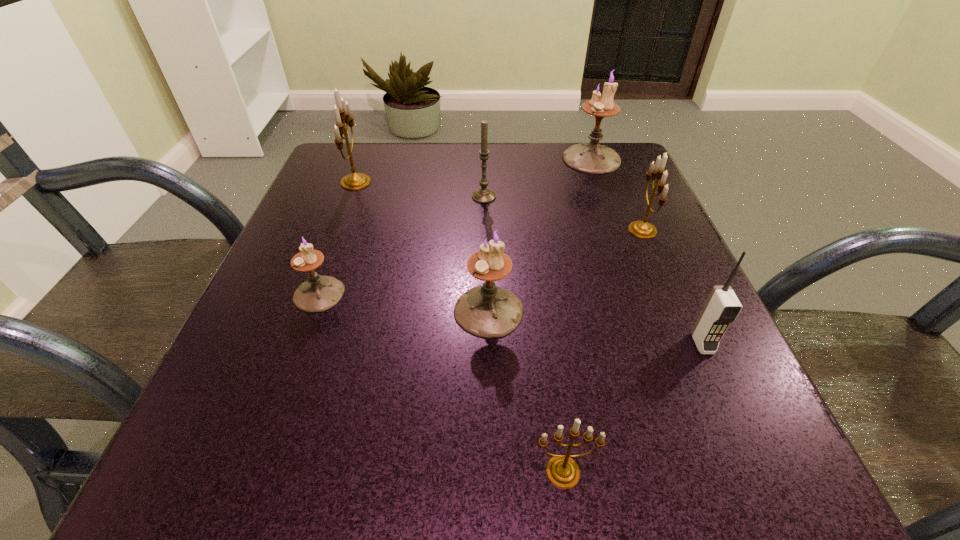
Image resolution: width=960 pixels, height=540 pixels. I want to click on free region at the near right corner of the desktop, so click(x=752, y=451).

You are a GUI agent. You are given a task and a screenshot of the screen. Output one action in this format:
    pyautogui.click(x=<x>, y=<y>)
    Task: Click on the unoccupied area between the third farthest candelabrum and the second purple candle holder from left to right
    The image size is (960, 540).
    Given the screenshot: What is the action you would take?
    pyautogui.click(x=565, y=271)

Locate an element on the screen. vacant point located between the nearest candelabrum and the rightmost purple candle holder is located at coordinates (577, 315).

The width and height of the screenshot is (960, 540). Find the location of `empty space between the second gold candelabrum from right to left and the farthest gold candelabrum`. empty space between the second gold candelabrum from right to left and the farthest gold candelabrum is located at coordinates (460, 327).

Where is `vacant space that is in between the second biggest gold candelabrum and the second smallest purple candle holder`? Image resolution: width=960 pixels, height=540 pixels. vacant space that is in between the second biggest gold candelabrum and the second smallest purple candle holder is located at coordinates pos(565,271).

I want to click on blank region between the biggest gold candelabrum and the second purple candle holder from right to left, so click(422, 246).

This screenshot has width=960, height=540. Identify the location of unoccupied area between the farthest purple candle holder and the gray candle. (538, 178).

Where is `free spot between the leftmost purple candle holder and the candle`? The width and height of the screenshot is (960, 540). free spot between the leftmost purple candle holder and the candle is located at coordinates (401, 245).

The image size is (960, 540). Identify the location of empty space between the fourth farthest object and the nearest candelabrum. (603, 351).

This screenshot has height=540, width=960. Identify the location of free area in between the smallest gold candelabrum and the fifth nearest object. (603, 351).